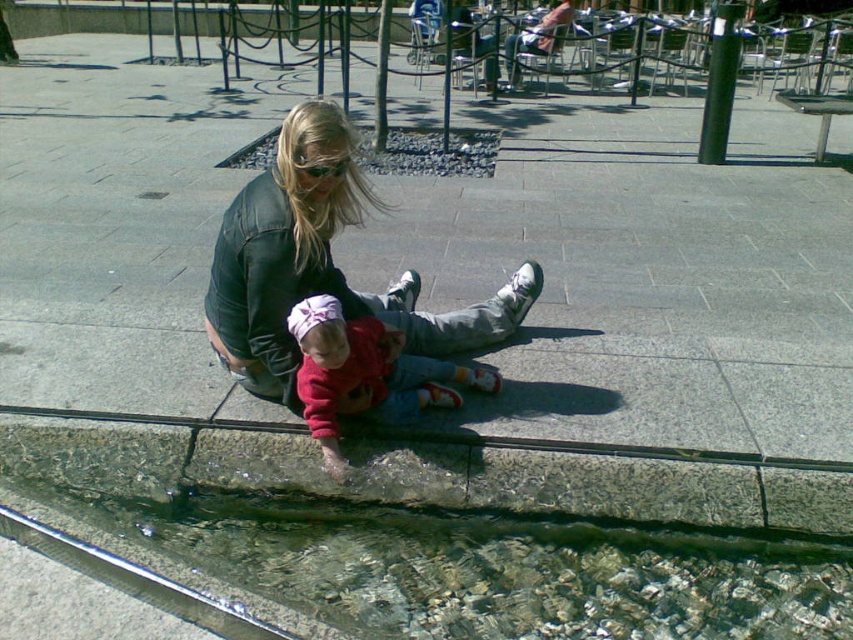
Which of these two, leather jacket at center or matte black goggles at center, stands shorter?

matte black goggles at center

Does leather jacket at center appear over matte black goggles at center?

Incorrect, leather jacket at center is not positioned above matte black goggles at center.

Which is behind, point (264, 250) or point (311, 172)?

The point (264, 250) is more distant.

Where is `leather jacket at center`? leather jacket at center is located at coordinates (322, 266).

Does leather jacket at center have a greater width compared to red fleece sweater at center?

Correct, the width of leather jacket at center exceeds that of red fleece sweater at center.

Does leather jacket at center lie behind red fleece sweater at center?

That is True.

What do you see at coordinates (322, 266) in the screenshot? I see `leather jacket at center` at bounding box center [322, 266].

Image resolution: width=853 pixels, height=640 pixels. I want to click on leather jacket at center, so click(322, 266).

Based on the photo, does clear glass curb at lower center have a larger size compared to matte black goggles at center?

Yes.

Looking at this image, between clear glass curb at lower center and matte black goggles at center, which one has less height?

matte black goggles at center is shorter.

Find the location of a particular element. The image size is (853, 640). clear glass curb at lower center is located at coordinates (608, 481).